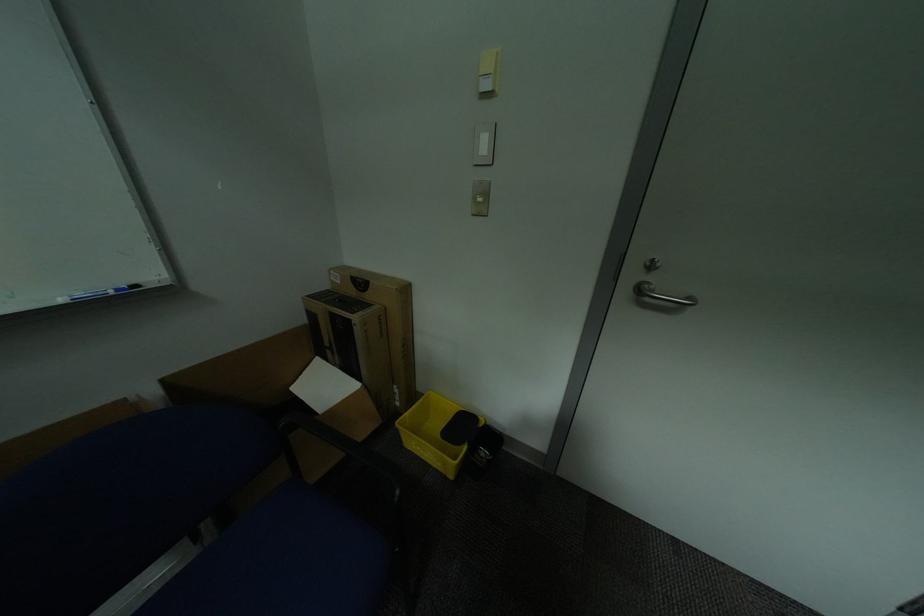
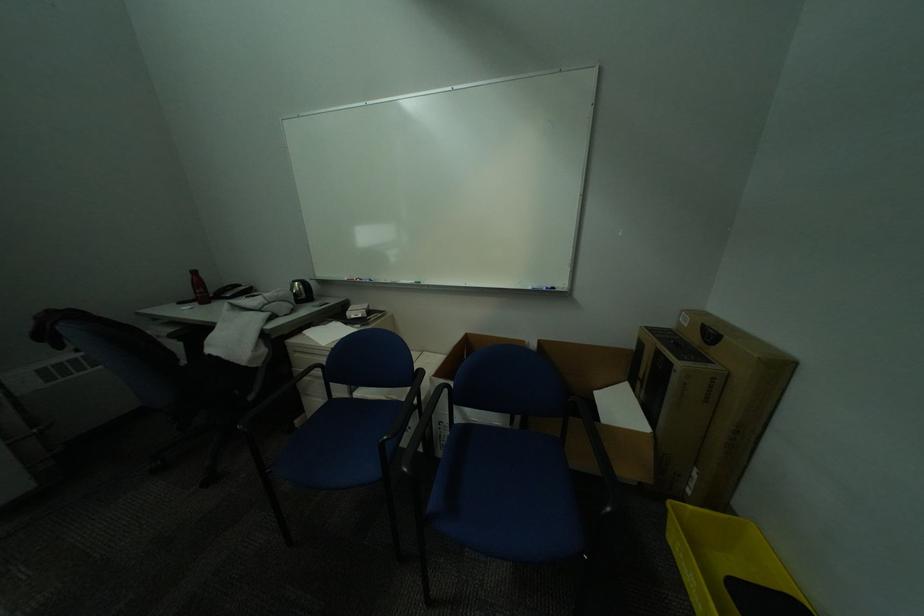
Find the pixel in the second image that matches the point at 304,389 in the first image.

(606, 394)